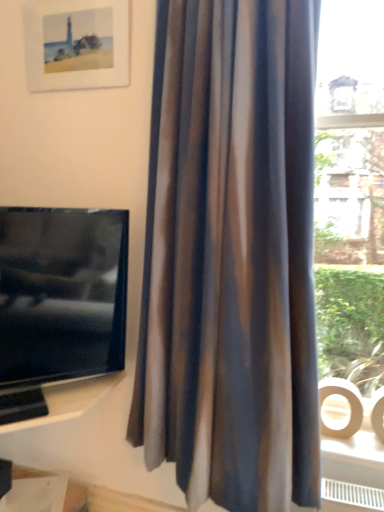
Question: From the image's perspective, is matte black tv at left on top of silky brown curtain at center?

Choices:
 (A) yes
 (B) no

Answer: (B)

Question: Is matte black tv at left oriented towards silky brown curtain at center?

Choices:
 (A) yes
 (B) no

Answer: (B)

Question: Is matte black tv at left next to silky brown curtain at center?

Choices:
 (A) yes
 (B) no

Answer: (B)

Question: Is the position of matte black tv at left less distant than that of silky brown curtain at center?

Choices:
 (A) yes
 (B) no

Answer: (B)

Question: From a real-world perspective, is matte black tv at left located higher than silky brown curtain at center?

Choices:
 (A) yes
 (B) no

Answer: (B)

Question: Considering the relative positions of matte black tv at left and matte paper picture frame at upper left in the image provided, is matte black tv at left to the left or to the right of matte paper picture frame at upper left?

Choices:
 (A) right
 (B) left

Answer: (A)

Question: From the image's perspective, is matte black tv at left above or below matte paper picture frame at upper left?

Choices:
 (A) below
 (B) above

Answer: (A)

Question: Is point (64, 248) closer or farther from the camera than point (102, 34)?

Choices:
 (A) closer
 (B) farther

Answer: (A)

Question: From a real-world perspective, is matte black tv at left physically located above or below matte paper picture frame at upper left?

Choices:
 (A) above
 (B) below

Answer: (B)

Question: Would you say white glossy shelf at lower left is inside or outside matte black tv at left?

Choices:
 (A) outside
 (B) inside

Answer: (A)

Question: From a real-world perspective, is white glossy shelf at lower left physically located above or below matte black tv at left?

Choices:
 (A) below
 (B) above

Answer: (A)

Question: Relative to matte black tv at left, is white glossy shelf at lower left in front or behind?

Choices:
 (A) front
 (B) behind

Answer: (B)

Question: Is white glossy shelf at lower left to the left or to the right of matte black tv at left in the image?

Choices:
 (A) right
 (B) left

Answer: (B)

Question: Is white glossy shelf at lower left in front of or behind silky brown curtain at center in the image?

Choices:
 (A) front
 (B) behind

Answer: (B)

Question: From the image's perspective, is white glossy shelf at lower left positioned above or below silky brown curtain at center?

Choices:
 (A) above
 (B) below

Answer: (B)